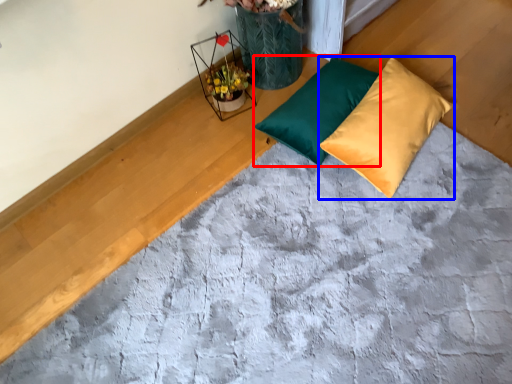
Question: Which object appears closest to the camera in this image, pillow (highlighted by a red box) or pillow (highlighted by a blue box)?

Choices:
 (A) pillow
 (B) pillow

Answer: (B)